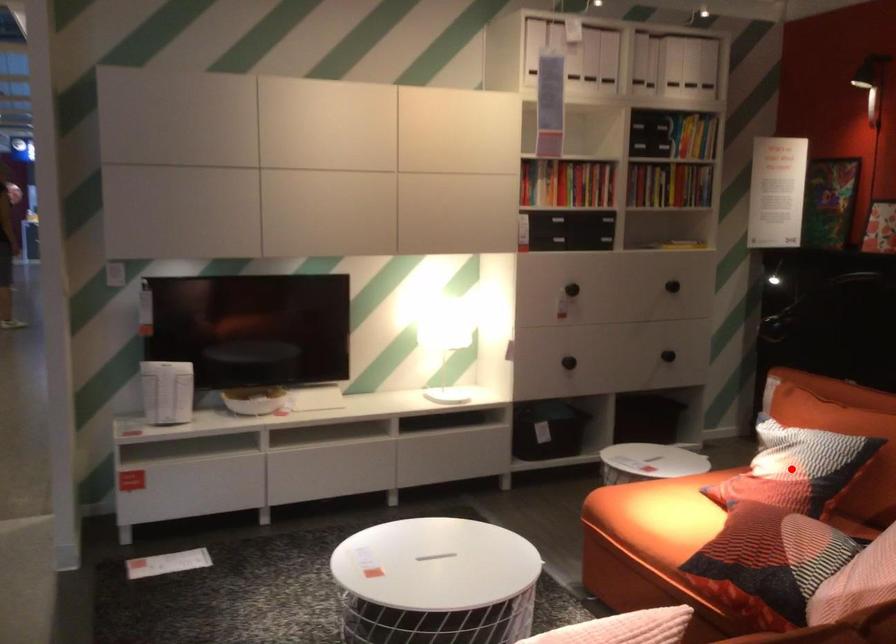
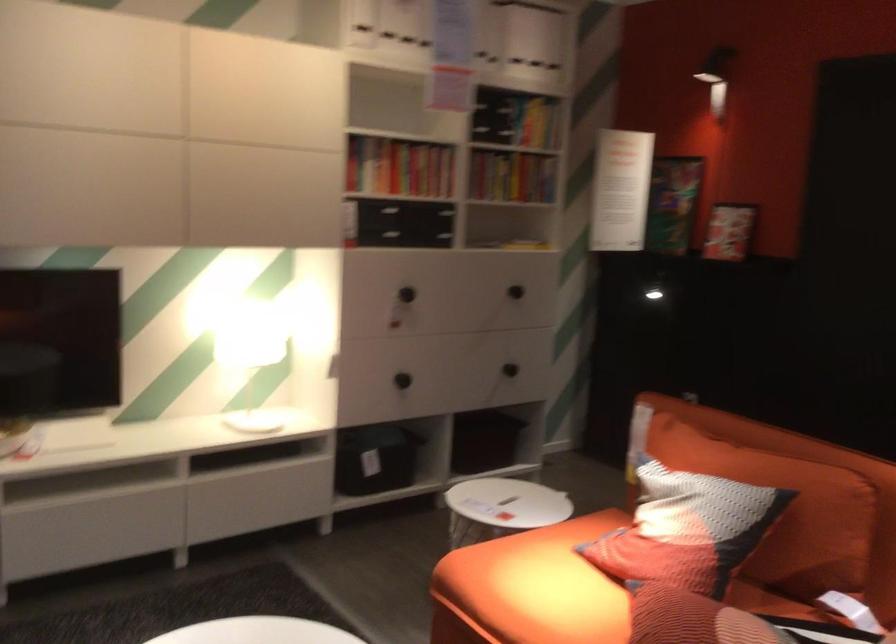
Locate, in the second image, the point that corresponds to the highlighted location in the first image.

(686, 529)